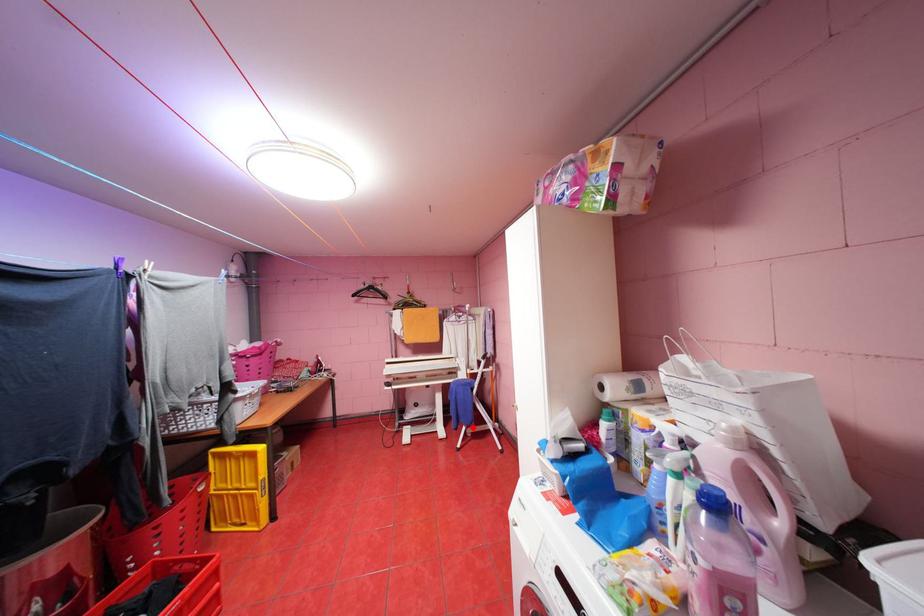
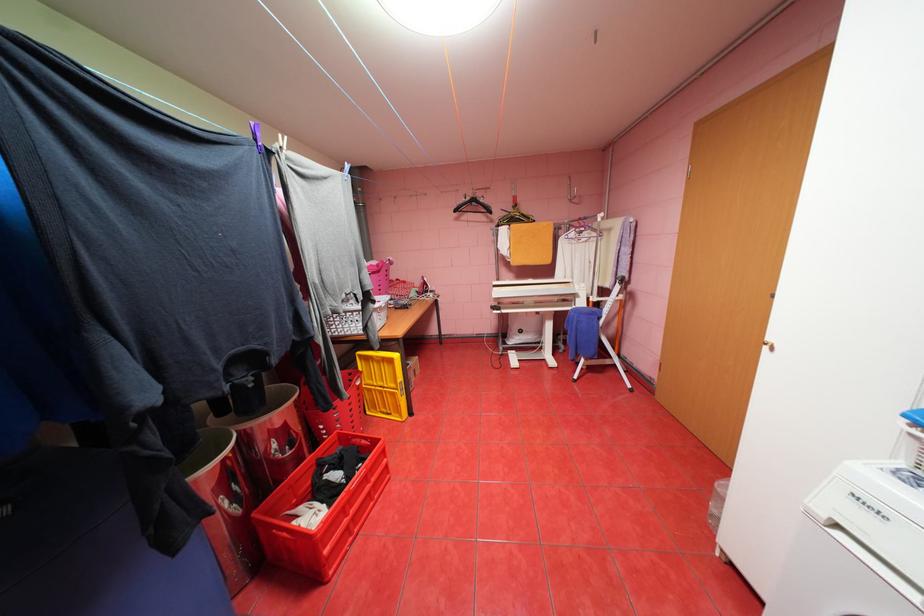
In the second image, find the point that corresponds to the highlighted location in the first image.

(591, 360)